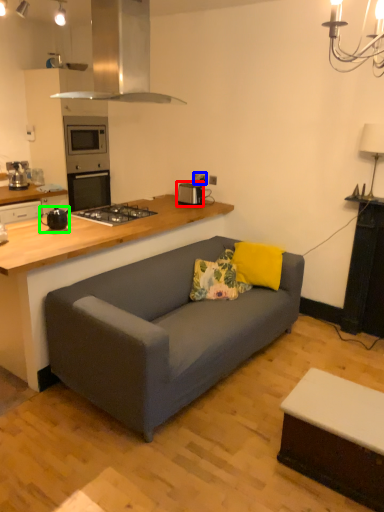
Question: Which object is positioned closest to appliance (highlighted by a red box)? Select from electric outlet (highlighted by a blue box) and appliance (highlighted by a green box).

Choices:
 (A) electric outlet
 (B) appliance

Answer: (A)